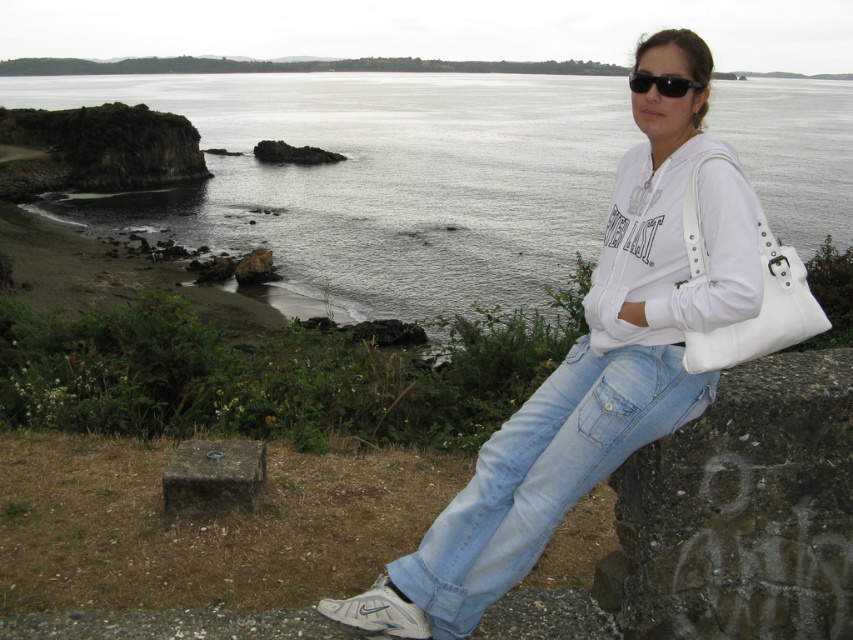
The image size is (853, 640). Identify the location of gray water at upper center. (379, 179).

Does gray water at upper center appear under dark gray stone at lower center?

Incorrect, gray water at upper center is not positioned below dark gray stone at lower center.

Identify the location of gray water at upper center. (379, 179).

Between point (807, 106) and point (662, 214), which one is positioned behind?

Positioned behind is point (807, 106).

Does point (508, 221) come in front of point (575, 372)?

No, (508, 221) is behind (575, 372).

Image resolution: width=853 pixels, height=640 pixels. Identify the location of gray water at upper center. (379, 179).

You are a GUI agent. You are given a task and a screenshot of the screen. Output one action in this format:
    pyautogui.click(x=<x>, y=<y>)
    Task: Click on the gray water at upper center
    
    Given the screenshot: What is the action you would take?
    pyautogui.click(x=379, y=179)

Who is higher up, gray water at upper center or light blue denim jeans at lower right?

gray water at upper center

Which is in front, point (310, 305) or point (495, 525)?

Point (495, 525) is in front.

This screenshot has height=640, width=853. I want to click on gray water at upper center, so click(379, 179).